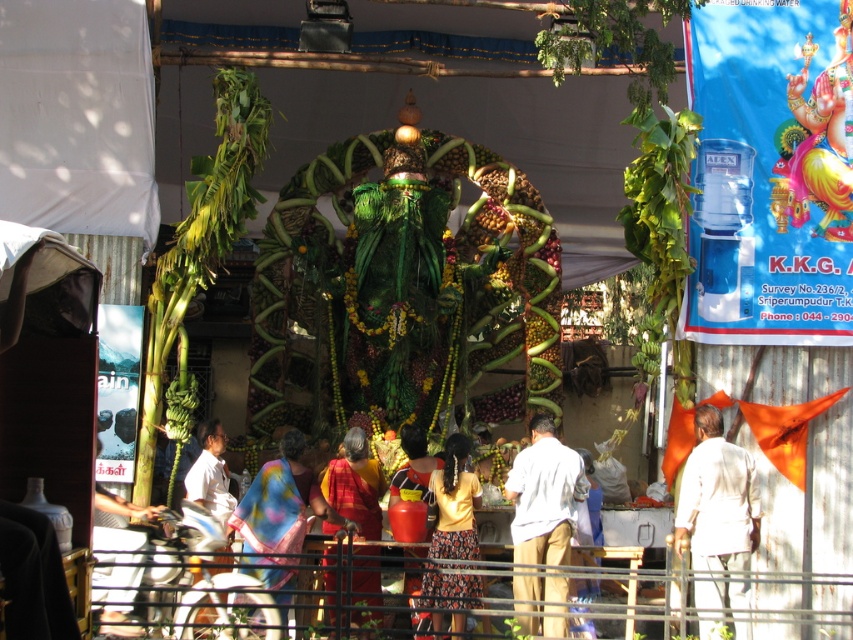
Which is in front, point (717, 497) or point (552, 563)?

Positioned in front is point (717, 497).

Does point (711, 456) come behind point (537, 428)?

No.

Who is more forward, (732, 504) or (538, 589)?

Point (732, 504)

Identify the location of white cloth at center. (717, 499).

Is yellow cotton dress at center wider than white matte shirt at center?

No.

Is yellow cotton dress at center shorter than white matte shirt at center?

No, yellow cotton dress at center is not shorter than white matte shirt at center.

Who is more distant from viewer, [454,476] or [218,515]?

Point [454,476]

Identify the location of yellow cotton dress at center. (456, 502).

Is metallic wire fence at lower center bigger than white matte shirt at center?

Yes.

Identify the location of metallic wire fence at lower center. (762, 600).

The image size is (853, 640). I want to click on metallic wire fence at lower center, so click(x=762, y=600).

What are the coordinates of `metallic wire fence at lower center` in the screenshot? It's located at (762, 600).